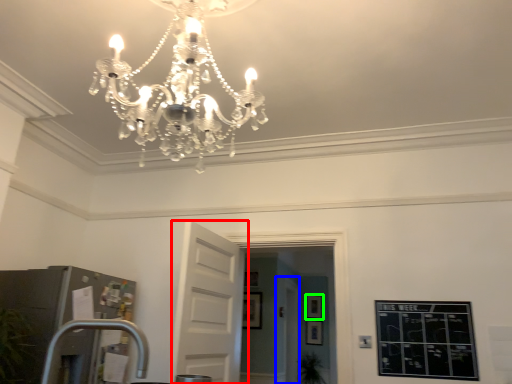
Question: Considering the real-world distances, which object is farthest from door (highlighted by a red box)? glass door (highlighted by a blue box) or picture frame (highlighted by a green box)?

Choices:
 (A) glass door
 (B) picture frame

Answer: (B)